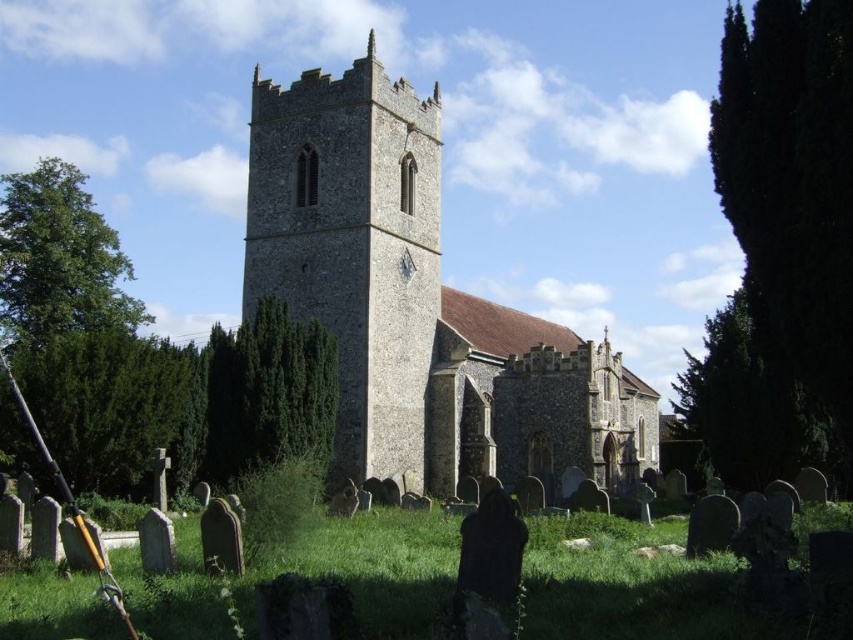
You are standing in front of the brown stone church at center. What are the coordinates of its position in the image?

The coordinates of the brown stone church at center are at point (416, 301).

You are standing in front of the historic stone church with the tall tower. There is a point marked at coordinates (416, 301). According to the image, where is this point located?

The point at (416, 301) is on the brown stone church at center.

You are standing in a park and see the brown stone church at center. If you want to take a photo of it from a distance of exactly 200 feet, should you move closer or farther away?

The brown stone church at center is currently 210.39 feet away from you. To achieve a distance of exactly 200 feet, you should move closer to the church by approximately 10.39 feet.